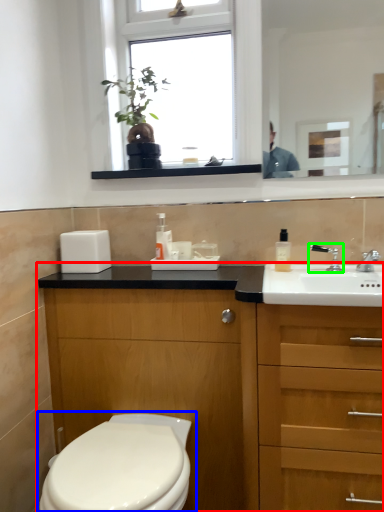
Question: Based on their relative distances, which object is farther from bathroom cabinet (highlighted by a red box)? Choose from toilet (highlighted by a blue box) and tap (highlighted by a green box).

Choices:
 (A) toilet
 (B) tap

Answer: (B)